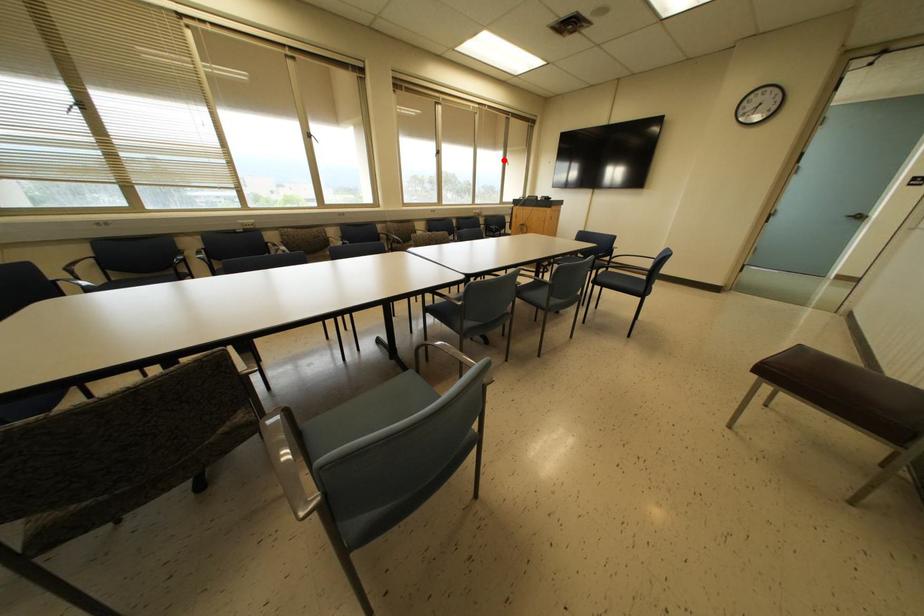
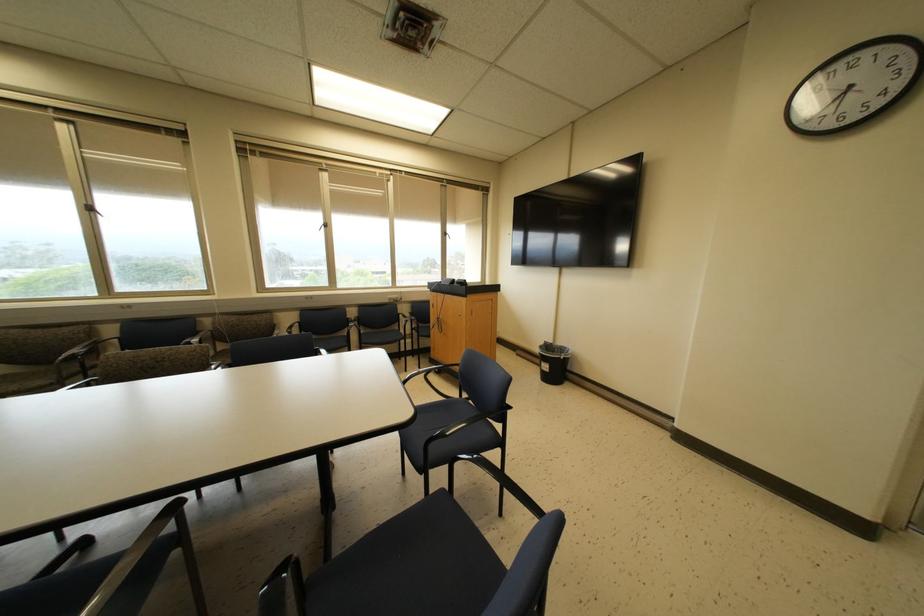
Where in the second image is the point corresponding to the highlighted location from the first image?

(444, 233)